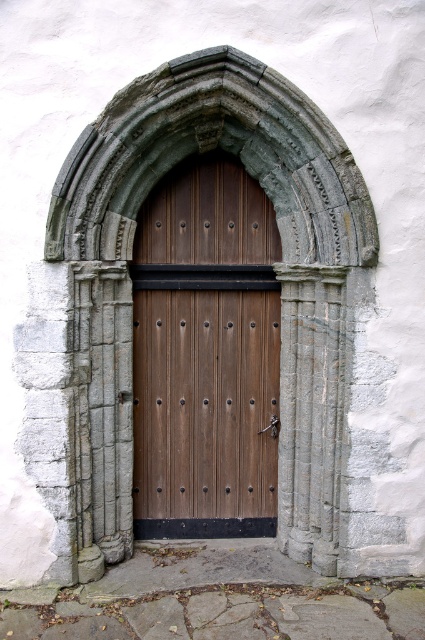
Is wooden door at center to the right of gray stone archway at center from the viewer's perspective?

In fact, wooden door at center is to the left of gray stone archway at center.

Is wooden door at center wider than gray stone archway at center?

In fact, wooden door at center might be narrower than gray stone archway at center.

Describe the element at coordinates (206, 355) in the screenshot. I see `wooden door at center` at that location.

Locate an element on the screen. This screenshot has width=425, height=640. wooden door at center is located at coordinates (206, 355).